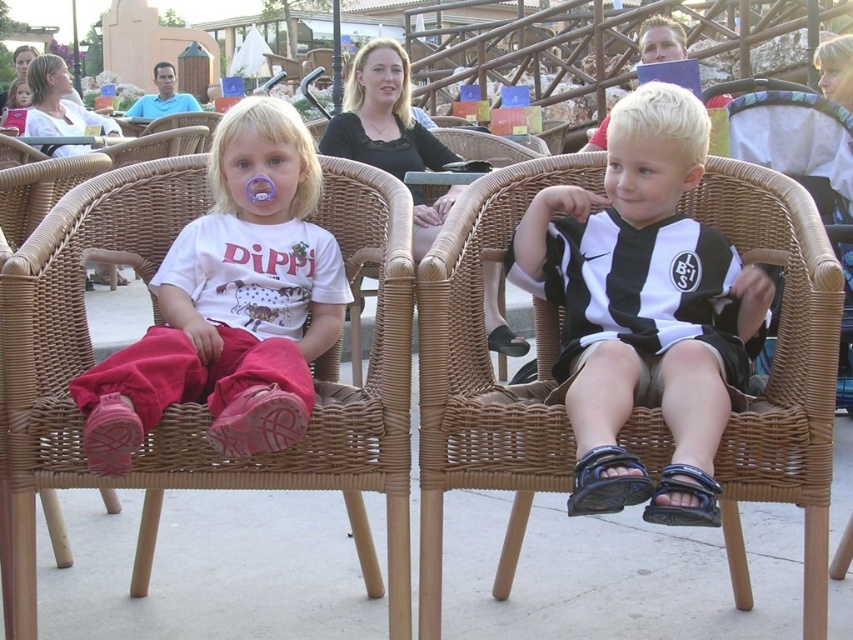
Question: Does woven wood chair at left have a larger size compared to matte white shirt at center?

Choices:
 (A) yes
 (B) no

Answer: (A)

Question: Is brown wicker chair at center above woven wood chair at left?

Choices:
 (A) no
 (B) yes

Answer: (B)

Question: Can you confirm if brown wicker chair at center is thinner than matte white shirt at center?

Choices:
 (A) no
 (B) yes

Answer: (B)

Question: Among these objects, which one is farthest from the camera?

Choices:
 (A) matte white shirt at center
 (B) black and white jersey at center
 (C) woven wood chair at left
 (D) brown wicker chair at center

Answer: (D)

Question: Which object is the farthest from the matte white shirt at center?

Choices:
 (A) brown wicker chair at center
 (B) woven wood chair at left
 (C) black and white jersey at center

Answer: (C)

Question: Which point is closer to the camera?

Choices:
 (A) (259, 435)
 (B) (718, 456)

Answer: (A)